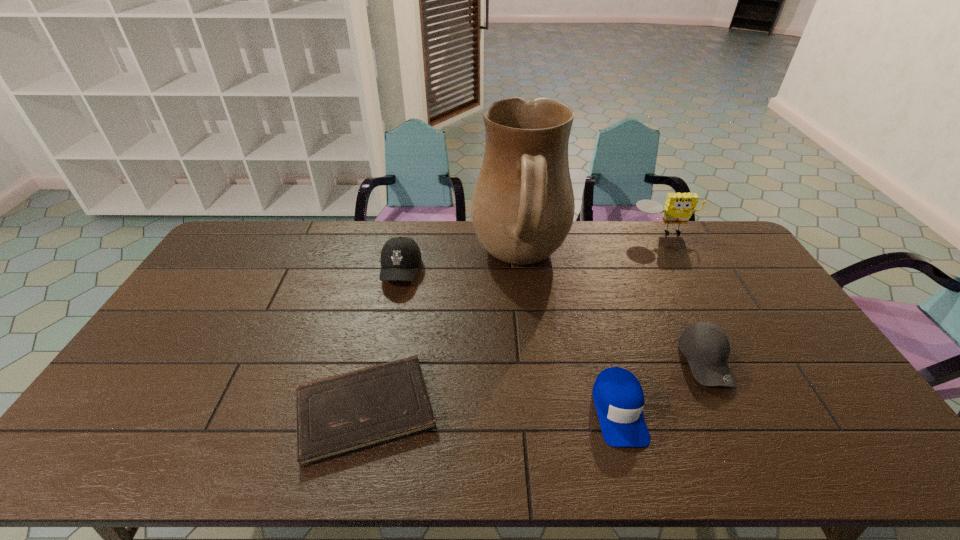
Where is `vacant space at the far edge`? This screenshot has height=540, width=960. vacant space at the far edge is located at coordinates (348, 251).

Identify the location of free space at the near edge. This screenshot has height=540, width=960. (517, 469).

Find the location of a particular element. The width and height of the screenshot is (960, 540). vacant region at the left edge of the desktop is located at coordinates (171, 335).

You are a GUI agent. You are given a task and a screenshot of the screen. Output one action in this format:
    pyautogui.click(x=<x>, y=<y>)
    Task: Click on the free space at the right edge of the desktop
    This screenshot has height=540, width=960.
    Given the screenshot: What is the action you would take?
    pyautogui.click(x=730, y=268)

Locate an element on the screen. vacant region at the far left corner of the desktop is located at coordinates (269, 229).

The height and width of the screenshot is (540, 960). I want to click on free space at the far right corner, so click(730, 245).

Identify the location of free space between the rightmost baseball cap and the second baseball cap from left to right. The width and height of the screenshot is (960, 540). (662, 385).

The image size is (960, 540). Identify the location of free space that is in between the cream pitcher and the second baseball cap from right to left. (569, 335).

Locate an element on the screen. The width and height of the screenshot is (960, 540). vacant area that lies between the tallest object and the farthest baseball cap is located at coordinates (461, 266).

At what (x,y) coordinates should I click in order to perform the action: click on free spot between the second baseball cap from left to right and the leftmost baseball cap. Please return your answer as a coordinate pair (x, y). The image size is (960, 540). Looking at the image, I should click on (510, 341).